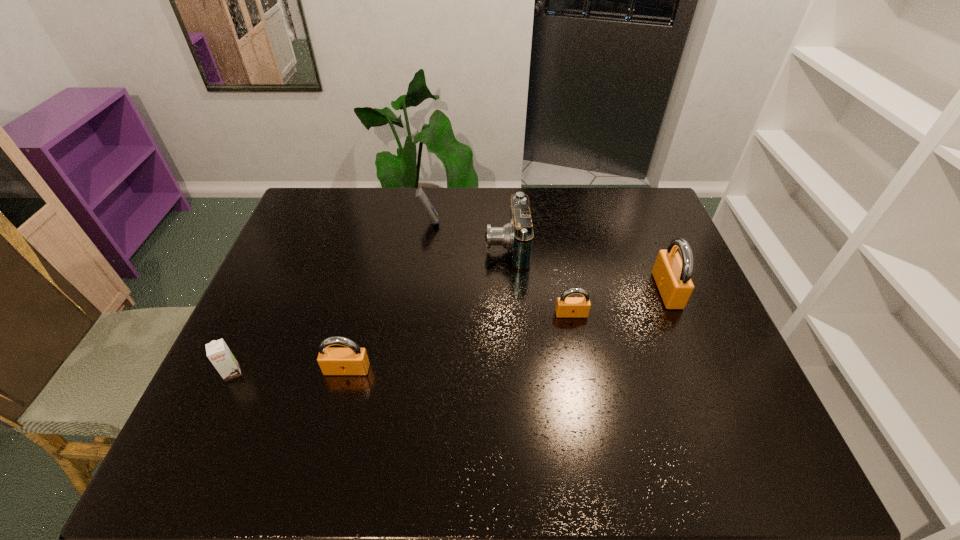
I want to click on free space between the calculator and the camcorder, so click(x=468, y=233).

This screenshot has height=540, width=960. Find the location of `empty location between the leftmost object and the third object from left to right`. empty location between the leftmost object and the third object from left to right is located at coordinates (330, 297).

You are a GUI agent. You are given a task and a screenshot of the screen. Output one action in this format:
    pyautogui.click(x=<x>, y=<y>)
    Task: Click on the free space between the camcorder and the rightmost object
    This screenshot has height=540, width=960.
    Given the screenshot: What is the action you would take?
    pyautogui.click(x=587, y=268)

Locate an element on the screen. This screenshot has width=960, height=540. free space between the rightmost object and the fourth object from right to left is located at coordinates (548, 255).

You are a GUI agent. You are given a task and a screenshot of the screen. Output one action in this format:
    pyautogui.click(x=<x>, y=<y>)
    Task: Click on the vacant space that is in between the calculator and the nearest padlock
    This screenshot has height=540, width=960.
    Given the screenshot: What is the action you would take?
    pyautogui.click(x=388, y=295)

Identify the location of vacant area between the leftmost object and the fifth object from left to right. This screenshot has height=540, width=960. (402, 343).

Where is `vacant space in between the third object from left to right and the camcorder`? The width and height of the screenshot is (960, 540). vacant space in between the third object from left to right and the camcorder is located at coordinates (468, 233).

Find the location of `vacant point located between the calculator and the camcorder`. vacant point located between the calculator and the camcorder is located at coordinates (468, 233).

Find the location of `empty space that is in between the tallest object and the third object from left to right`. empty space that is in between the tallest object and the third object from left to right is located at coordinates (548, 255).

Select which object appears as the second closest to the second object from left to right. Please provide its 2D coordinates. Your answer should be formatted as a tuple, i.e. [(x, y)], where the tuple contains the x and y coordinates of a point satisfying the conditions above.

[(516, 236)]